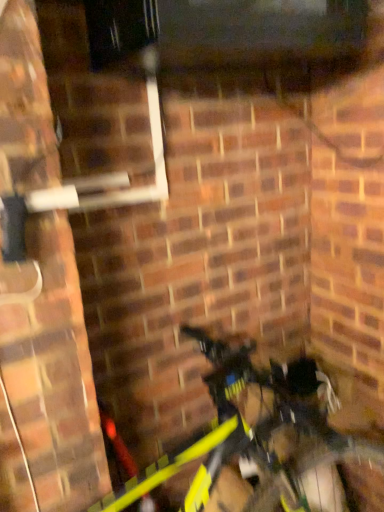
Measure the distance between yellow matte bicycle at lower center and camera.

yellow matte bicycle at lower center and camera are 31.23 inches apart from each other.

Describe the element at coordinates (251, 426) in the screenshot. The width and height of the screenshot is (384, 512). I see `yellow matte bicycle at lower center` at that location.

Image resolution: width=384 pixels, height=512 pixels. I want to click on yellow matte bicycle at lower center, so click(x=251, y=426).

In order to click on yellow matte bicycle at lower center in this screenshot , I will do `click(251, 426)`.